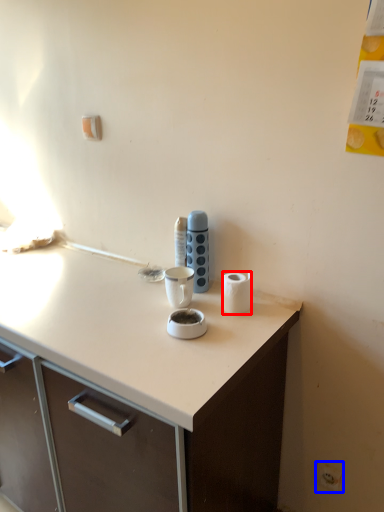
Question: Among these objects, which one is farthest to the camera, paper towel (highlighted by a red box) or electric outlet (highlighted by a blue box)?

Choices:
 (A) paper towel
 (B) electric outlet

Answer: (B)